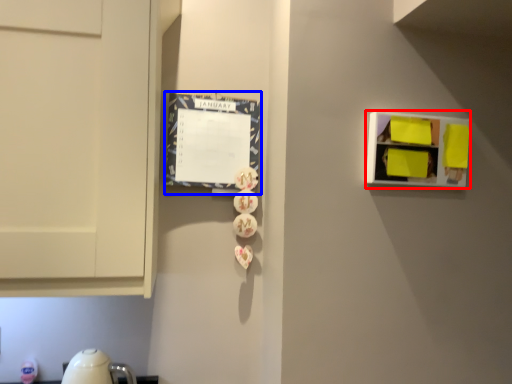
Question: Which object is closer to the camera taking this photo, shelf (highlighted by a red box) or bulletin board (highlighted by a blue box)?

Choices:
 (A) shelf
 (B) bulletin board

Answer: (A)